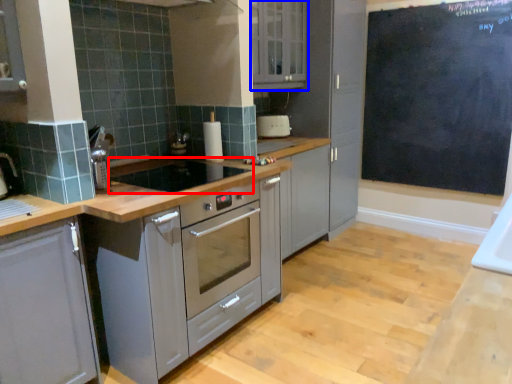
Question: Which object appears farthest to the camera in this image, gas stove (highlighted by a red box) or cabinetry (highlighted by a blue box)?

Choices:
 (A) gas stove
 (B) cabinetry

Answer: (B)